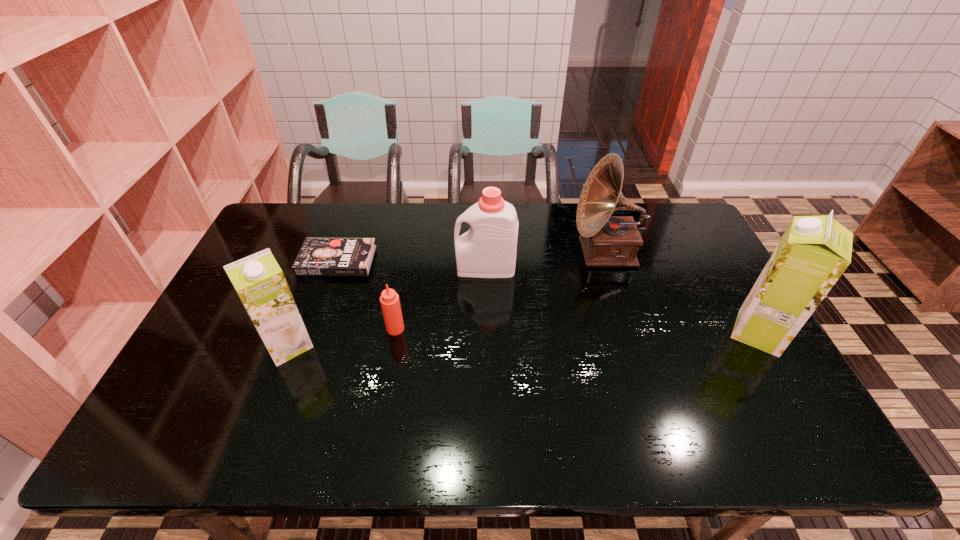
Please determine a free point for an extra soya_milk to ensure balance. Please provide its 2D coordinates. Your answer should be formatted as a tuple, i.e. [(x, y)], where the tuple contains the x and y coordinates of a point satisfying the conditions above.

[(526, 339)]